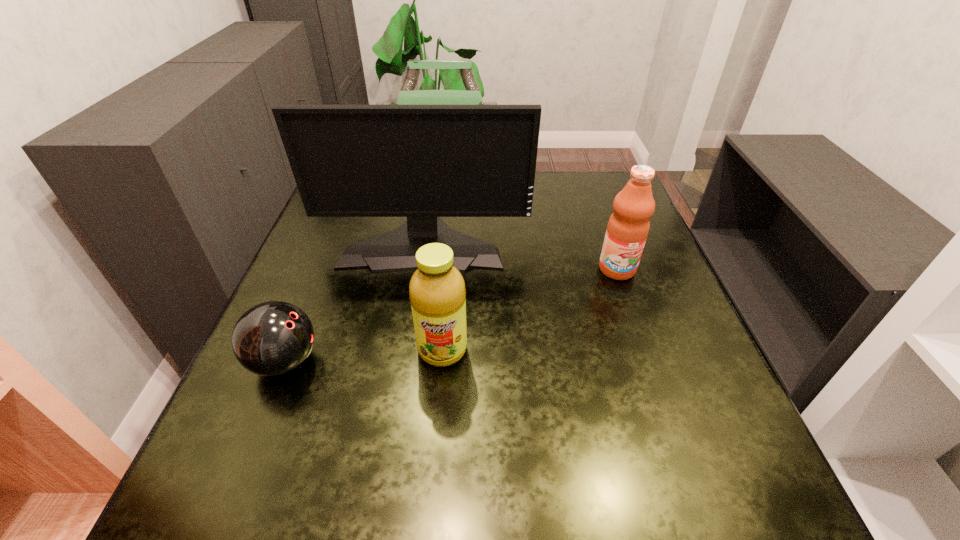
You are a GUI agent. You are given a task and a screenshot of the screen. Output one action in this format:
    pyautogui.click(x=<x>, y=<y>)
    Task: Click on the tallest object
    The image size is (960, 540).
    Given the screenshot: What is the action you would take?
    pyautogui.click(x=423, y=162)

Locate an element on the screen. Image resolution: width=960 pixels, height=540 pixels. the farther fruit juice is located at coordinates (628, 226).

Where is `the right fruit juice`? This screenshot has height=540, width=960. the right fruit juice is located at coordinates (628, 226).

Where is `the nearer fruit juice`? The image size is (960, 540). the nearer fruit juice is located at coordinates (437, 291).

This screenshot has width=960, height=540. I want to click on bowling ball, so click(273, 338).

Identify the location of vacant space situated on the screen side of the tallest object. [405, 362].

Find the location of a particular element. This screenshot has height=540, width=960. free space located on the front label of the rightmost object is located at coordinates (649, 360).

Locate an element on the screen. vacant region located on the front label of the left fruit juice is located at coordinates point(435,441).

Where is `free spot located 0.350m on the surface of the shortest object near the finger holes`? The height and width of the screenshot is (540, 960). free spot located 0.350m on the surface of the shortest object near the finger holes is located at coordinates (505, 362).

Identify the location of monitor present at the left edge. The width and height of the screenshot is (960, 540). (423, 162).